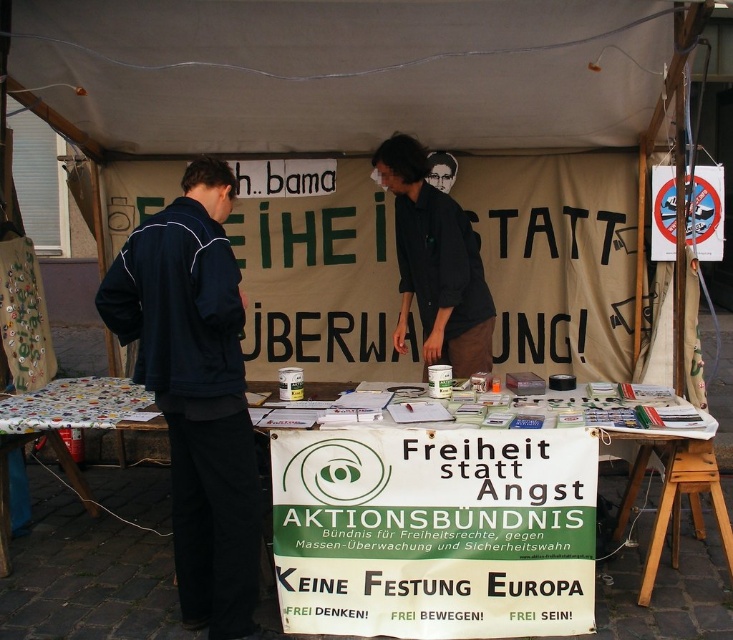
Question: Which point is closer to the camera taking this photo?

Choices:
 (A) (336, 563)
 (B) (457, 259)
 (C) (619, 102)

Answer: (A)

Question: Estimate the real-world distances between objects in this image. Which object is closer to the white fabric canopy at upper center?

Choices:
 (A) black matte shirt at center
 (B) dark blue jacket at left

Answer: (A)

Question: Can you confirm if white paper table at center is positioned to the right of dark blue jacket at left?

Choices:
 (A) yes
 (B) no

Answer: (A)

Question: Which point is closer to the camera?

Choices:
 (A) (228, 426)
 (B) (84, 60)
 (C) (313, 480)

Answer: (A)

Question: In this image, where is dark blue jacket at left located relative to black matte shirt at center?

Choices:
 (A) above
 (B) below

Answer: (B)

Question: Can you confirm if white paper table at center is positioned to the left of black matte shirt at center?

Choices:
 (A) no
 (B) yes

Answer: (A)